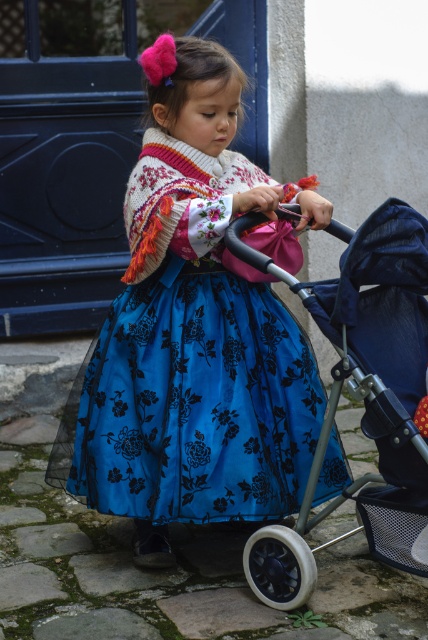
Between point (276, 310) and point (270, 570), which one is positioned in front?

Point (270, 570) is in front.

Which is behind, point (110, 308) or point (374, 492)?

Point (110, 308)

Identify the location of blue satin dress at center. (193, 362).